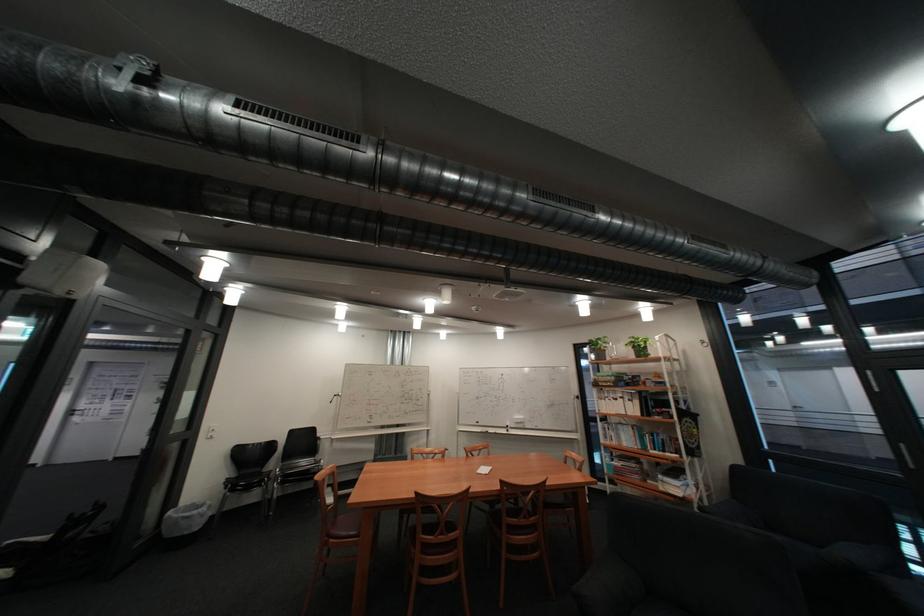
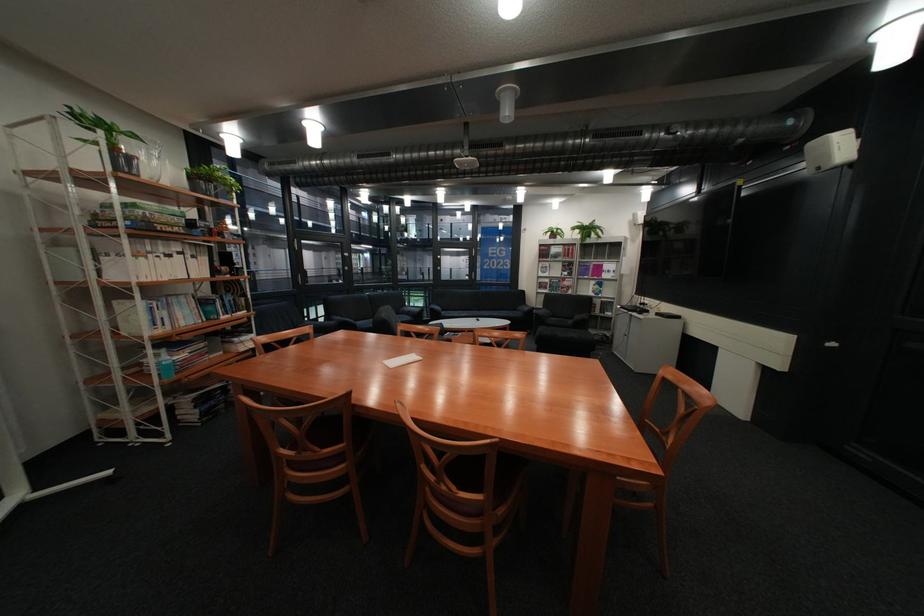
The point at (621,359) is marked in the first image. Where is the corresponding point in the second image?

(152, 177)